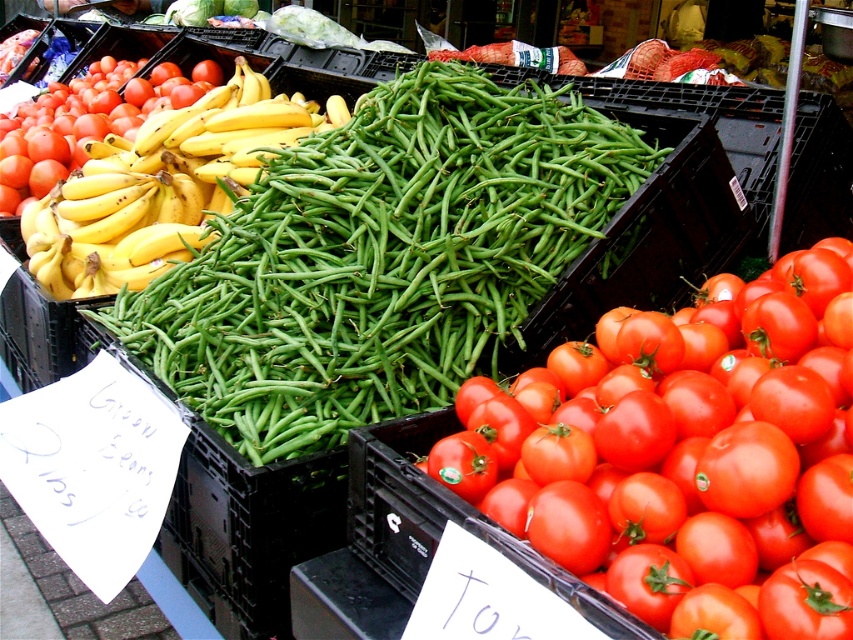
Can you confirm if shiny red tomato at center right is smaller than shiny red tomato at left?

Indeed, shiny red tomato at center right has a smaller size compared to shiny red tomato at left.

Can you confirm if shiny red tomato at center right is wider than shiny red tomato at left?

No, shiny red tomato at center right is not wider than shiny red tomato at left.

Is point (712, 360) in front of point (45, 102)?

Yes, it is in front of point (45, 102).

Locate an element on the screen. shiny red tomato at center right is located at coordinates (686, 456).

Who is positioned more to the left, green matte beans at center or yellow matte bananas at left?

yellow matte bananas at left is more to the left.

Is point (544, 172) closer to camera compared to point (248, 176)?

That is True.

This screenshot has height=640, width=853. In order to click on green matte beans at center in this screenshot , I will do `click(381, 259)`.

Describe the element at coordinates (381, 259) in the screenshot. I see `green matte beans at center` at that location.

Can you confirm if green matte beans at center is taller than shiny red tomato at left?

No.

Is point (506, 100) positioned in front of point (132, 109)?

Yes, point (506, 100) is in front of point (132, 109).

At what (x,y) coordinates should I click in order to perform the action: click on green matte beans at center. Please return your answer as a coordinate pair (x, y). Looking at the image, I should click on (381, 259).